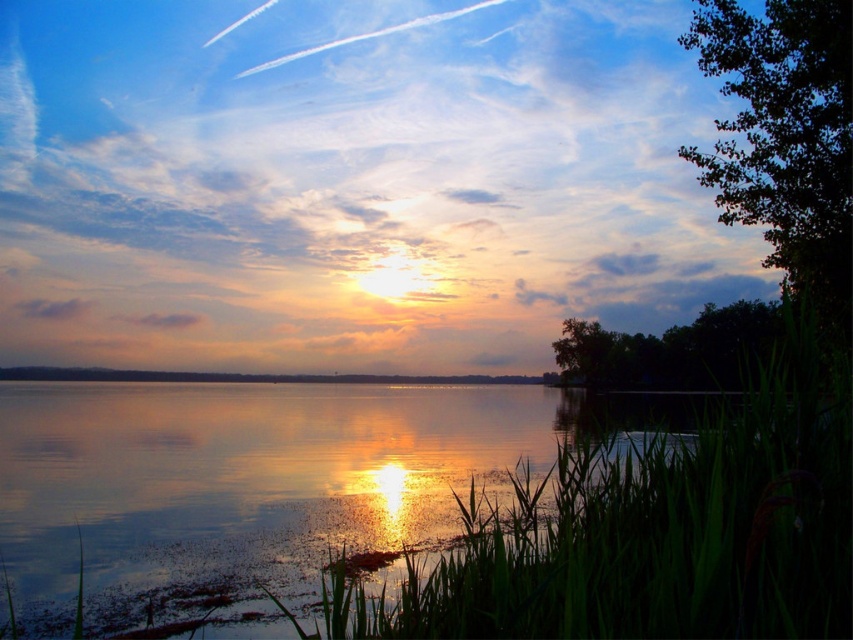
Question: Observing the image, what is the correct spatial positioning of glistening water at center in reference to dark green leafy tree at upper right?

Choices:
 (A) left
 (B) right

Answer: (A)

Question: Among these points, which one is nearest to the camera?

Choices:
 (A) click(x=380, y=456)
 (B) click(x=566, y=378)
 (C) click(x=821, y=45)

Answer: (C)

Question: Which of the following is the closest to the observer?

Choices:
 (A) click(x=573, y=406)
 (B) click(x=846, y=259)

Answer: (B)

Question: Is glistening water at center above dark green leafy tree at upper right?

Choices:
 (A) no
 (B) yes

Answer: (A)

Question: Does glistening water at center have a larger size compared to dark green leafy tree at upper right?

Choices:
 (A) yes
 (B) no

Answer: (A)

Question: Which of the following is the closest to the observer?

Choices:
 (A) (555, 416)
 (B) (804, 54)
 (C) (590, 324)

Answer: (B)